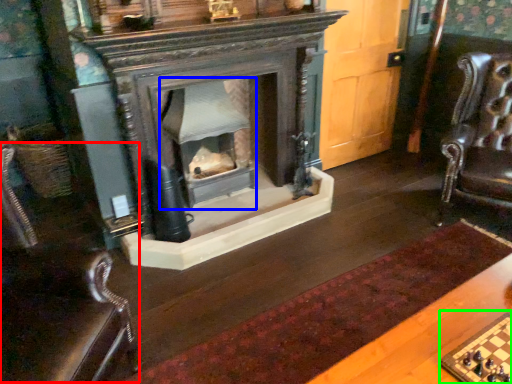
Question: Based on their relative distances, which object is nearer to rocking chair (highlighted by a red box)? Choose from fireplace (highlighted by a blue box) and board game (highlighted by a green box).

Choices:
 (A) fireplace
 (B) board game

Answer: (B)